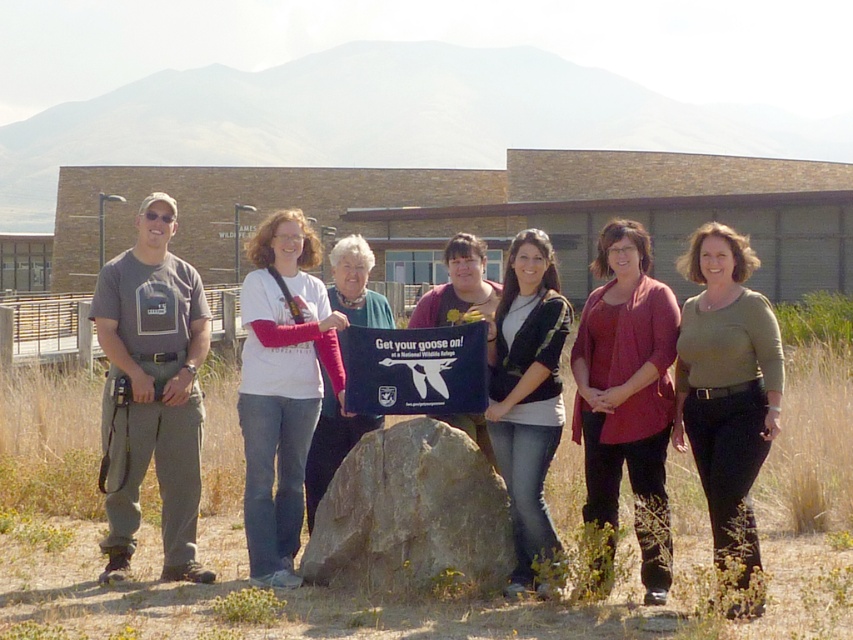
You are standing at the point with coordinates point (427,365). You want to move to the point with coordinates point (520,368). Is the point you want to reach located behind you?

Yes, the point (520,368) is behind point (427,365), so the point you want to reach is located behind you.

You are a photographer trying to capture a group photo where the white cotton shirt at center and the matte black shirt at center are both visible. Based on their heights, which one might you need to adjust the camera angle for to ensure both are fully visible?

The white cotton shirt at center is much taller than the matte black shirt at center. To ensure both are fully visible, you might need to lower the camera angle slightly to capture the taller individual without cropping them.

You are a photographer standing in front of the group. You want to take a photo that includes both the gray rock at center and the blue fabric sign at center. Which object should you focus on first to ensure both are in sharp focus?

You should focus on the gray rock at center first because it is closer to the viewer than the blue fabric sign at center, so starting with the closer object ensures depth of field includes both.